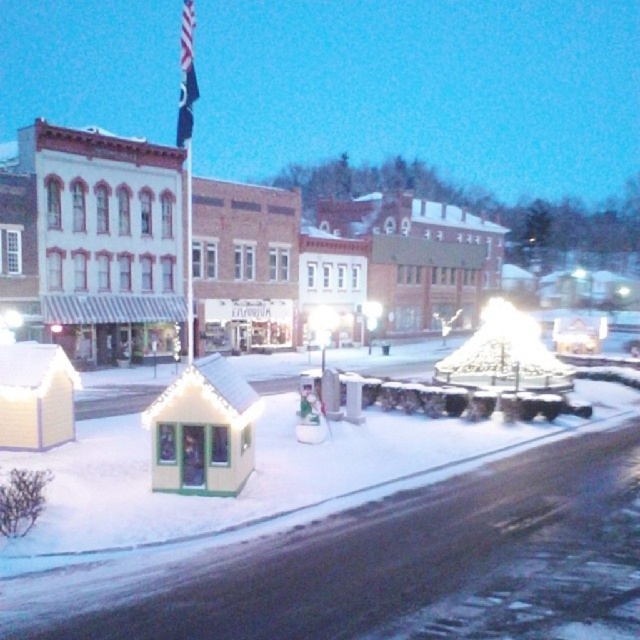
You are a delivery drone with a maximum flight range of 30 meters. You need to deliver a package from the snowman to the brick building at center. Can you complete the delivery without needing to recharge?

The distance between the snowman and the brick building at center is 32.90 meters, which exceeds the drone s 30 meter range. Therefore, the drone cannot complete the delivery without recharging.

In the scene shown: You are a city planner reviewing this winter scene. You need to assess whether the brick building at center will block the view of the black fabric flag at upper center from the street level. Based on their heights, what do you conclude?

The brick building at center is shorter than the black fabric flag at upper center, so the flag will remain visible from street level as the building does not obstruct its view.